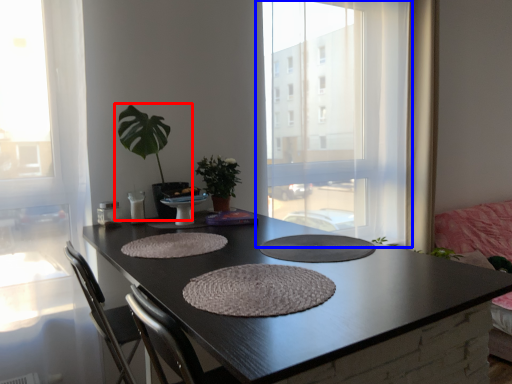
Question: Which object is closer to the camera taking this photo, houseplant (highlighted by a red box) or window (highlighted by a blue box)?

Choices:
 (A) houseplant
 (B) window

Answer: (A)